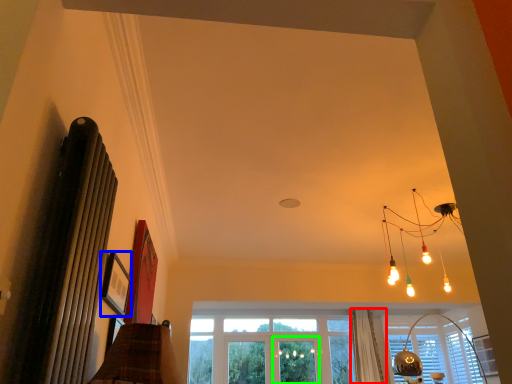
Question: Which object is the farthest from curtain (highlighted by a red box)? Choose among these: picture frame (highlighted by a blue box) or screen door (highlighted by a green box).

Choices:
 (A) picture frame
 (B) screen door

Answer: (A)